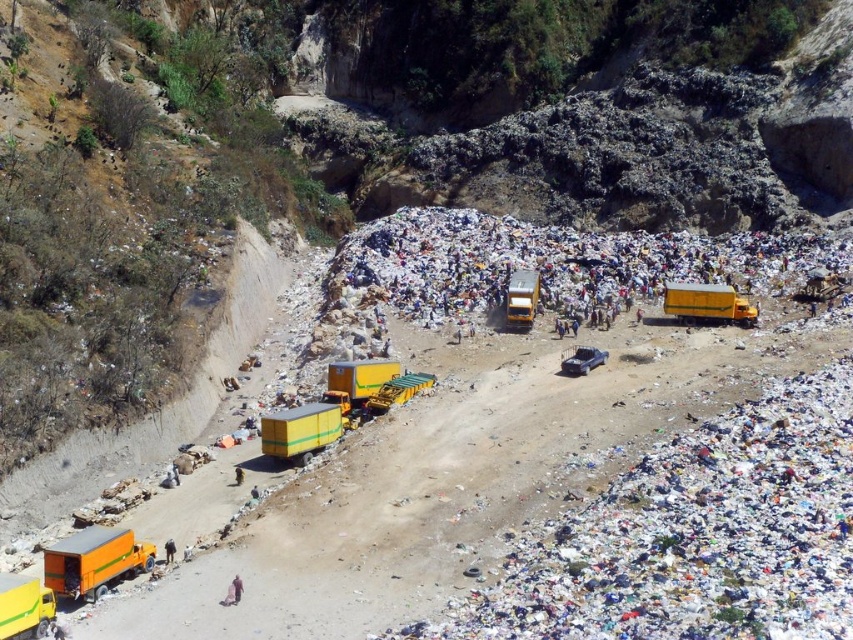
You are a waste management supervisor who needs to inspect both the yellow matte truck at right and the yellow matte truck at center. Which truck should you check first if you want to avoid climbing any inclines?

The yellow matte truck at right should be checked first because it is positioned under the yellow matte truck at center, meaning it is located at a lower elevation. This allows the supervisor to start at the lower truck and move upwards to the one above without needing to climb initially.

You are a waste management supervisor checking the landfill site. You need to park a new truck that is 3 meters wide. There is space between the yellow matte truck at right and the yellow matte truck at center. Can the new truck fit in that space?

The yellow matte truck at right is wider than the yellow matte truck at center. Since the space between them may depend on their widths, but without knowing the exact distance between them, it is uncertain if the new truck can fit. However, since the truck at the right is wider, the space might be larger, but we cannot confirm without more information.

You are standing at the edge of the landfill and want to determine which of the two points, point (19, 609) or point (514, 285), is nearer to you. Based on the scene, which point is closer?

Point (19, 609) is closer to the viewer than point (514, 285).